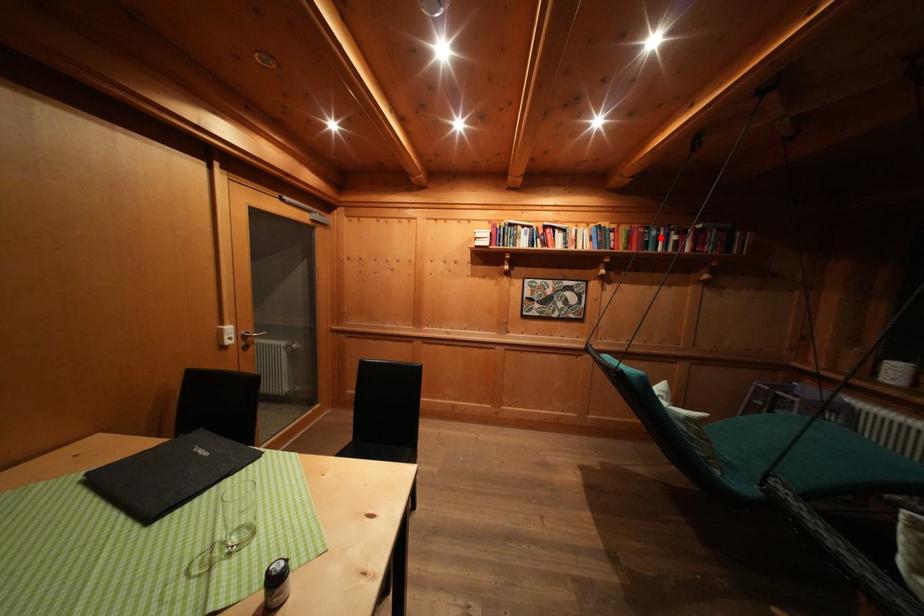
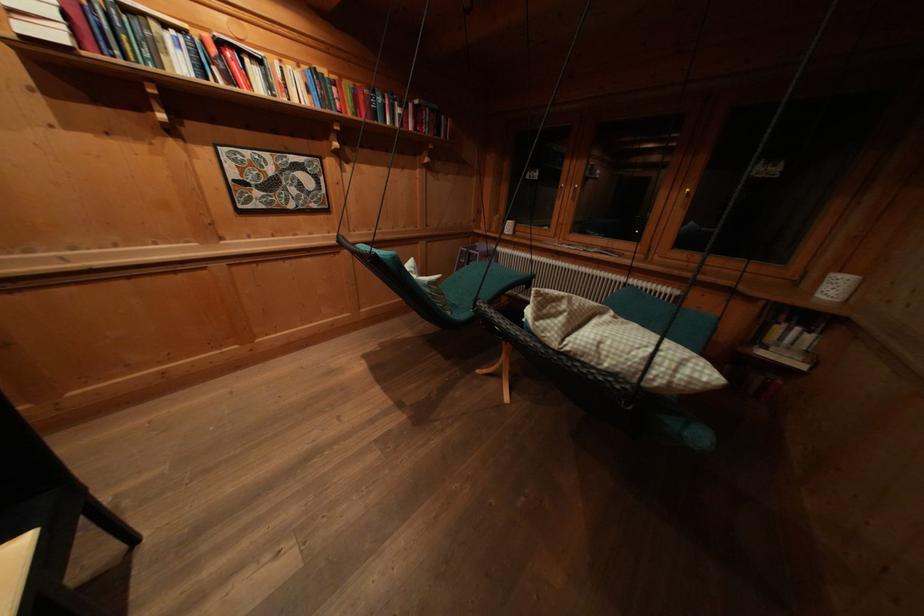
In the second image, find the point that corresponds to the highlighted location in the first image.

(385, 103)